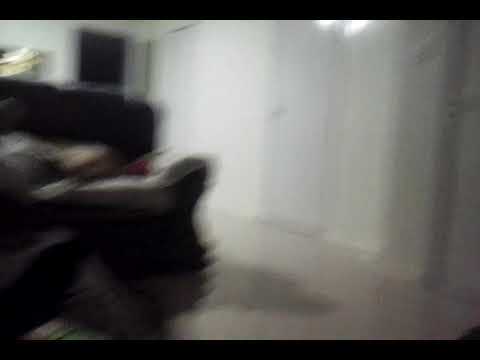
The width and height of the screenshot is (480, 360). Find the location of `floor`. floor is located at coordinates (316, 298).